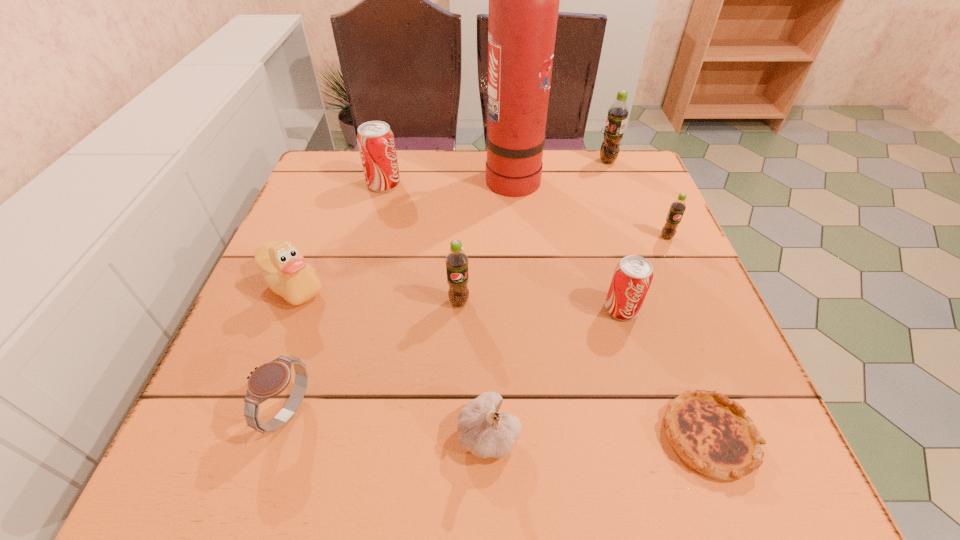
You are a GUI agent. You are given a task and a screenshot of the screen. Output one action in this format:
    pyautogui.click(x=<x>, y=<y>)
    Task: Click on the vacant point located between the duck and the second biggest green soda
    This screenshot has width=960, height=540.
    Given the screenshot: What is the action you would take?
    pyautogui.click(x=376, y=294)

Where is `object that can be found as the second closest to the duck`? The width and height of the screenshot is (960, 540). object that can be found as the second closest to the duck is located at coordinates (456, 261).

Point out which object is positioned as the eighth nearest to the beige duck. Please provide its 2D coordinates. Your answer should be formatted as a tuple, i.e. [(x, y)], where the tuple contains the x and y coordinates of a point satisfying the conditions above.

[(677, 208)]

Identify the location of the closest soda to the watch. This screenshot has height=540, width=960. (456, 261).

Find the location of a particular element. soda object that ranks as the second closest to the watch is located at coordinates (633, 275).

The image size is (960, 540). Find the location of `green soda that is the nearest to the farthest soda`. green soda that is the nearest to the farthest soda is located at coordinates (677, 208).

Locate which green soda is the closest to the shortest object. Please provide its 2D coordinates. Your answer should be formatted as a tuple, i.e. [(x, y)], where the tuple contains the x and y coordinates of a point satisfying the conditions above.

[(456, 261)]

Find the location of `vacant area that satisfies the following two spatial constraints: 1. on the back side of the garlic; 2. on the left side of the third soda from left to right`. vacant area that satisfies the following two spatial constraints: 1. on the back side of the garlic; 2. on the left side of the third soda from left to right is located at coordinates (487, 309).

The image size is (960, 540). In order to click on vacant region that satisfies the following two spatial constraints: 1. on the label side of the fire extinguisher; 2. on the right side of the nearer red soda can in this screenshot , I will do `click(525, 309)`.

The width and height of the screenshot is (960, 540). I want to click on vacant area in the image that satisfies the following two spatial constraints: 1. on the front label of the garlic; 2. on the left side of the fourth soda from right to left, so click(453, 434).